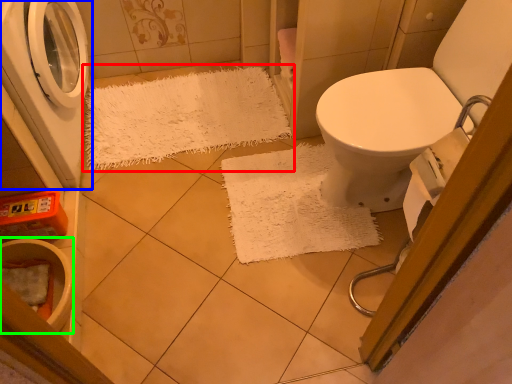
Question: Which object is the farthest from doormat (highlighted by a red box)? Choose among these: washing machine (highlighted by a blue box) or toilet bowl (highlighted by a green box).

Choices:
 (A) washing machine
 (B) toilet bowl

Answer: (B)